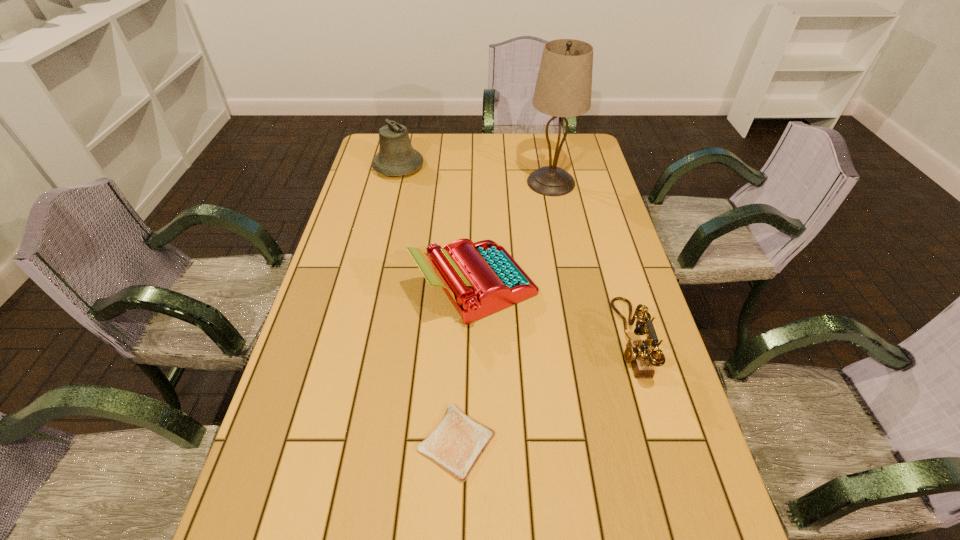
You are a GUI agent. You are given a task and a screenshot of the screen. Output one action in this format:
    pyautogui.click(x=<x>, y=<y>)
    Task: Click on the vacant area at the far edge
    The width and height of the screenshot is (960, 540).
    Given the screenshot: What is the action you would take?
    pyautogui.click(x=483, y=136)

Locate an element on the screen. The width and height of the screenshot is (960, 540). free region at the left edge of the desktop is located at coordinates (363, 262).

Locate an element on the screen. The image size is (960, 540). free spot at the right edge of the desktop is located at coordinates (622, 235).

Identify the location of free spot at the far left corner of the desktop. click(x=370, y=160).

Find the location of a particular element. free spot at the far right corner of the desktop is located at coordinates (571, 138).

Image resolution: width=960 pixels, height=540 pixels. In order to click on free spot between the toast and the typewriter in this screenshot , I will do `click(467, 364)`.

You are a GUI agent. You are given a task and a screenshot of the screen. Output one action in this format:
    pyautogui.click(x=<x>, y=<y>)
    Task: Click on the free space between the bell and the lampshade
    This screenshot has width=960, height=540.
    Given the screenshot: What is the action you would take?
    pyautogui.click(x=475, y=174)

Where is `free space between the toast and the third shortest object`? This screenshot has width=960, height=540. free space between the toast and the third shortest object is located at coordinates (467, 364).

Where is `empty space that is in between the third shortest object and the second shortest object`? Image resolution: width=960 pixels, height=540 pixels. empty space that is in between the third shortest object and the second shortest object is located at coordinates (553, 313).

You are a GUI agent. You are given a task and a screenshot of the screen. Output one action in this format:
    pyautogui.click(x=<x>, y=<y>)
    Task: Click on the vacant region between the typewriter and the fourth tallest object
    Image resolution: width=960 pixels, height=540 pixels.
    Given the screenshot: What is the action you would take?
    (553, 313)